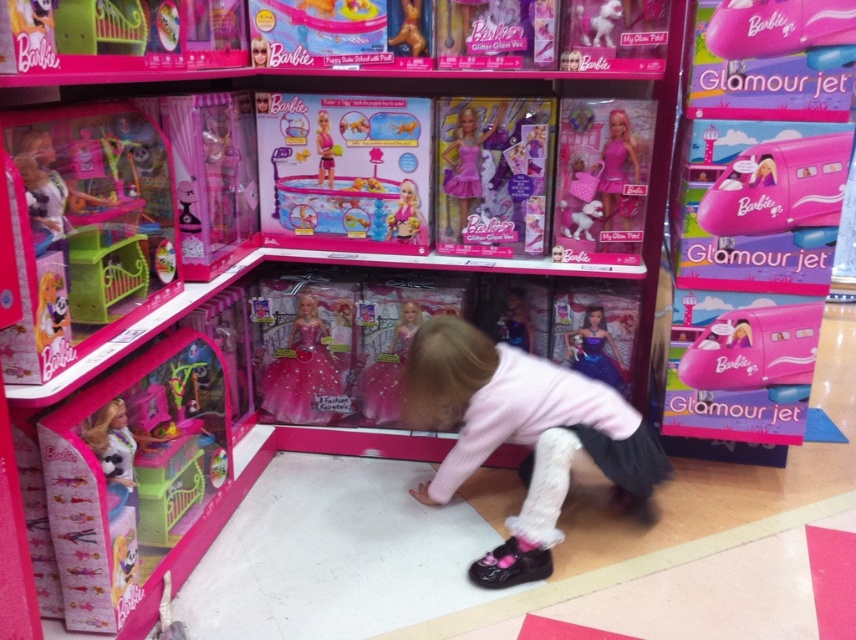
Is pink plastic glamour jet at lower right smaller than pink plastic doll at upper center?

Incorrect, pink plastic glamour jet at lower right is not smaller in size than pink plastic doll at upper center.

In the scene shown: Can you confirm if pink plastic glamour jet at lower right is shorter than pink plastic doll at upper center?

Incorrect, pink plastic glamour jet at lower right's height does not fall short of pink plastic doll at upper center's.

In order to click on pink plastic glamour jet at lower right in this screenshot , I will do `click(756, 352)`.

Can you confirm if pink fabric skirt at center is taller than pink satin dress at center?

Yes, pink fabric skirt at center is taller than pink satin dress at center.

The width and height of the screenshot is (856, 640). What do you see at coordinates (524, 436) in the screenshot?
I see `pink fabric skirt at center` at bounding box center [524, 436].

Is point (657, 458) farther from viewer compared to point (450, 188)?

That is False.

At what (x,y) coordinates should I click in order to perform the action: click on pink fabric skirt at center. Please return your answer as a coordinate pair (x, y). The image size is (856, 640). Looking at the image, I should click on (524, 436).

Does pink glossy glamour jet at upper right lie behind pink satin dress at center?

No, pink glossy glamour jet at upper right is in front of pink satin dress at center.

How distant is pink glossy glamour jet at upper right from pink satin dress at center?

The distance of pink glossy glamour jet at upper right from pink satin dress at center is 29.64 inches.

Locate an element on the screen. This screenshot has width=856, height=640. pink glossy glamour jet at upper right is located at coordinates 782,189.